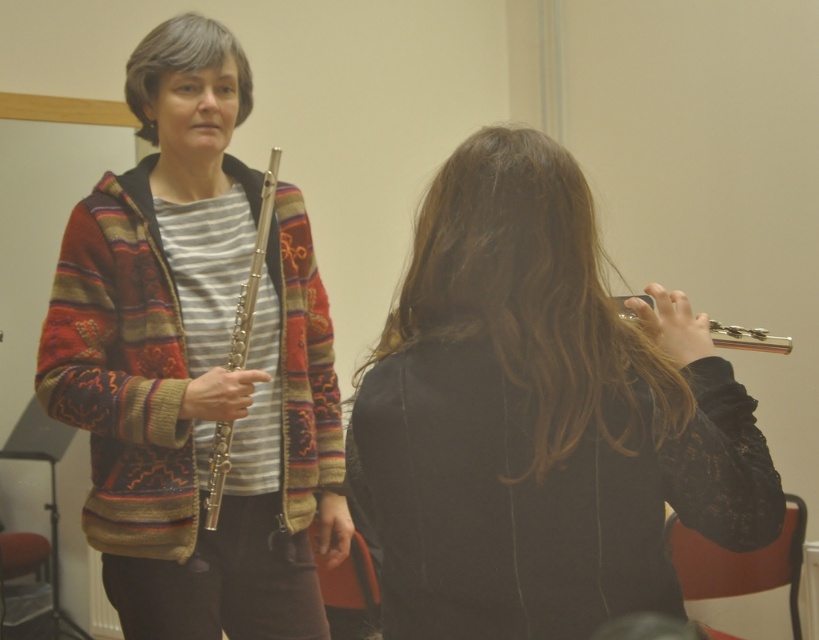
Is knitted wool sweater at center closer to camera compared to silver metallic flute at right?

No, it is not.

Is point (209, 600) less distant than point (627, 308)?

No, (209, 600) is further to viewer.

Is point (80, 408) positioned behind point (715, 346)?

Yes, it is.

I want to click on knitted wool sweater at center, so click(x=197, y=365).

Which is below, knitted wool sweater at center or silver metallic flute at left?

silver metallic flute at left is lower down.

Which of these two, knitted wool sweater at center or silver metallic flute at left, stands taller?

With more height is knitted wool sweater at center.

Which is in front, point (227, 262) or point (256, 280)?

Point (256, 280) is more forward.

Identify the location of knitted wool sweater at center. The width and height of the screenshot is (819, 640). (197, 365).

Is black fabric jacket at center thinner than silver metallic flute at left?

No, black fabric jacket at center is not thinner than silver metallic flute at left.

Does point (532, 576) lie behind point (247, 316)?

That is False.

Between point (686, 356) and point (263, 177), which one is positioned in front?

Positioned in front is point (686, 356).

Where is `black fabric jacket at center`? This screenshot has width=819, height=640. black fabric jacket at center is located at coordinates point(541,417).